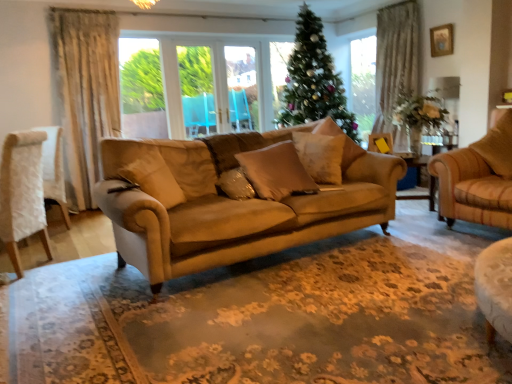
In order to click on white fabric chair at left in this screenshot , I will do `click(22, 193)`.

What is the approximate height of beige fabric pillow at right, which is the first pillow from right to left?

It is 24.87 inches.

Locate an element on the screen. The image size is (512, 384). satin beige pillow at center, arranged as the 3th pillow when viewed from the right is located at coordinates (320, 156).

Identify the location of satin beige pillow at center, marked as the 4th pillow in a right-to-left arrangement. (276, 172).

Does green metallic christmas tree at center turn towards satin beige pillow at center, marked as the 4th pillow in a right-to-left arrangement?

No, green metallic christmas tree at center is not facing towards satin beige pillow at center, marked as the 4th pillow in a right-to-left arrangement.

Between green metallic christmas tree at center and satin beige pillow at center, which is the 3th pillow from left to right, which one has larger width?

Wider between the two is green metallic christmas tree at center.

Which is more to the right, green metallic christmas tree at center or satin beige pillow at center, marked as the 4th pillow in a right-to-left arrangement?

green metallic christmas tree at center.

From a real-world perspective, is green metallic christmas tree at center positioned above or below satin beige pillow at center, marked as the 4th pillow in a right-to-left arrangement?

In terms of real-world spatial position, green metallic christmas tree at center is above satin beige pillow at center, marked as the 4th pillow in a right-to-left arrangement.

Considering the relative sizes of white fabric chair at left and satin gold pillow at center, which appears as the 2th pillow when viewed from the left, in the image provided, is white fabric chair at left shorter than satin gold pillow at center, which appears as the 2th pillow when viewed from the left,?

No.

Which of these two, white fabric chair at left or satin gold pillow at center, positioned as the 5th pillow in right-to-left order, is smaller?

satin gold pillow at center, positioned as the 5th pillow in right-to-left order.

From a real-world perspective, which object rests below the other?

white fabric chair at left is physically lower.

Consider the image. Could satin gold pillow at center, positioned as the 5th pillow in right-to-left order, be considered to be inside white fabric chair at left?

No, satin gold pillow at center, positioned as the 5th pillow in right-to-left order, is located outside of white fabric chair at left.

Which object is thinner, satin beige pillow at center, arranged as the 3th pillow when viewed from the right, or satin beige pillow at center, which is the 3th pillow from left to right?

satin beige pillow at center, arranged as the 3th pillow when viewed from the right.

From the picture: Could you tell me if satin beige pillow at center, the 4th pillow in the left-to-right sequence, is turned towards satin beige pillow at center, marked as the 4th pillow in a right-to-left arrangement?

Yes, satin beige pillow at center, the 4th pillow in the left-to-right sequence, is turned towards satin beige pillow at center, marked as the 4th pillow in a right-to-left arrangement.

From a real-world perspective, does satin beige pillow at center, arranged as the 3th pillow when viewed from the right, stand above satin beige pillow at center, marked as the 4th pillow in a right-to-left arrangement?

Correct, in the physical world, satin beige pillow at center, arranged as the 3th pillow when viewed from the right, is higher than satin beige pillow at center, marked as the 4th pillow in a right-to-left arrangement.

Is satin beige pillow at center, arranged as the 3th pillow when viewed from the right, bigger or smaller than satin beige pillow at center, which is the 3th pillow from left to right?

satin beige pillow at center, arranged as the 3th pillow when viewed from the right, is smaller than satin beige pillow at center, which is the 3th pillow from left to right.

From the picture: Is satin gold pillow at center, which appears as the 2th pillow when viewed from the left, oriented towards satin beige pillow at center, marked as the 4th pillow in a right-to-left arrangement?

Yes, satin gold pillow at center, which appears as the 2th pillow when viewed from the left, is aimed at satin beige pillow at center, marked as the 4th pillow in a right-to-left arrangement.

Is satin beige pillow at center, which is the 3th pillow from left to right, surrounded by satin gold pillow at center, positioned as the 5th pillow in right-to-left order?

No.

From the image's perspective, is satin gold pillow at center, positioned as the 5th pillow in right-to-left order, under satin beige pillow at center, marked as the 4th pillow in a right-to-left arrangement?

Yes.

Between satin gold pillow at center, positioned as the 5th pillow in right-to-left order, and satin beige pillow at center, marked as the 4th pillow in a right-to-left arrangement, which one has more height?

satin beige pillow at center, marked as the 4th pillow in a right-to-left arrangement, is taller.

Can you confirm if satin beige pillow at center, the 4th pillow in the left-to-right sequence, is positioned to the right of white fabric chair at left?

Yes, satin beige pillow at center, the 4th pillow in the left-to-right sequence, is to the right of white fabric chair at left.

Which is behind, satin beige pillow at center, the 4th pillow in the left-to-right sequence, or white fabric chair at left?

satin beige pillow at center, the 4th pillow in the left-to-right sequence, is behind.

From a real-world perspective, is satin beige pillow at center, the 4th pillow in the left-to-right sequence, positioned above or below white fabric chair at left?

satin beige pillow at center, the 4th pillow in the left-to-right sequence, is situated higher than white fabric chair at left in the real world.

Is wooden picture frame at upper right positioned before beige fabric pillow at center, the sixth pillow in the right-to-left sequence?

That is False.

Considering the sizes of objects wooden picture frame at upper right and beige fabric pillow at center, which is the first pillow from left to right, in the image provided, who is taller, wooden picture frame at upper right or beige fabric pillow at center, which is the first pillow from left to right,?

beige fabric pillow at center, which is the first pillow from left to right, is taller.

Does point (443, 40) come in front of point (157, 184)?

That is False.

From a real-world perspective, between wooden picture frame at upper right and beige fabric pillow at center, which is the first pillow from left to right, who is vertically higher?

wooden picture frame at upper right, from a real-world perspective.

Which is behind, point (226, 191) or point (324, 133)?

The point (324, 133) is more distant.

From a real-world perspective, is satin gold pillow at center, which appears as the 2th pillow when viewed from the left, physically below suede-like beige pillow at center, the fifth pillow in the left-to-right sequence?

Correct, in the physical world, satin gold pillow at center, which appears as the 2th pillow when viewed from the left, is lower than suede-like beige pillow at center, the fifth pillow in the left-to-right sequence.

From the image's perspective, which object appears higher, satin gold pillow at center, positioned as the 5th pillow in right-to-left order, or suede-like beige pillow at center, acting as the 2th pillow starting from the right?

From the image's view, suede-like beige pillow at center, acting as the 2th pillow starting from the right, is above.

Identify the location of pillow that is the 3rd one when counting leftward from the green metallic christmas tree at center. (276, 172).

Image resolution: width=512 pixels, height=384 pixels. In order to click on chair below the satin gold pillow at center, positioned as the 5th pillow in right-to-left order (from the image's perspective) in this screenshot , I will do `click(22, 193)`.

Based on their spatial positions, is beige fabric pillow at center, the sixth pillow in the right-to-left sequence, or satin gold pillow at center, positioned as the 5th pillow in right-to-left order, closer to suede-like beige pillow at center, the fifth pillow in the left-to-right sequence?

satin gold pillow at center, positioned as the 5th pillow in right-to-left order, lies closer to suede-like beige pillow at center, the fifth pillow in the left-to-right sequence, than the other object.

Estimate the real-world distances between objects in this image. Which object is further from satin gold pillow at center, which appears as the 2th pillow when viewed from the left, satin beige pillow at center, which is the 3th pillow from left to right, or beige fabric pillow at center, which is the first pillow from left to right?

Based on the image, beige fabric pillow at center, which is the first pillow from left to right, appears to be further to satin gold pillow at center, which appears as the 2th pillow when viewed from the left.

Looking at this image, looking at the image, which one is located further to beige fabric pillow at center, the sixth pillow in the right-to-left sequence, satin beige pillow at center, the 4th pillow in the left-to-right sequence, or green metallic christmas tree at center?

green metallic christmas tree at center lies further to beige fabric pillow at center, the sixth pillow in the right-to-left sequence, than the other object.

Estimate the real-world distances between objects in this image. Which object is closer to satin gold pillow at center, positioned as the 5th pillow in right-to-left order, satin beige pillow at center, marked as the 4th pillow in a right-to-left arrangement, or wooden picture frame at upper right?

satin beige pillow at center, marked as the 4th pillow in a right-to-left arrangement, is closer to satin gold pillow at center, positioned as the 5th pillow in right-to-left order.

Considering their positions, is beige fabric pillow at center, the sixth pillow in the right-to-left sequence, positioned further to satin gold pillow at center, which appears as the 2th pillow when viewed from the left, than satin beige pillow at center, arranged as the 3th pillow when viewed from the right?

Based on the image, satin beige pillow at center, arranged as the 3th pillow when viewed from the right, appears to be further to satin gold pillow at center, which appears as the 2th pillow when viewed from the left.

Looking at the image, which one is located further to satin beige pillow at center, which is the 3th pillow from left to right, satin beige pillow at center, the 4th pillow in the left-to-right sequence, or wooden picture frame at upper right?

The object further to satin beige pillow at center, which is the 3th pillow from left to right, is wooden picture frame at upper right.

From the image, which object appears to be nearer to white fabric chair at left, green metallic christmas tree at center or wooden picture frame at upper right?

The object closer to white fabric chair at left is green metallic christmas tree at center.

Considering their positions, is satin beige pillow at center, marked as the 4th pillow in a right-to-left arrangement, positioned closer to green metallic christmas tree at center than beige fabric pillow at center, the sixth pillow in the right-to-left sequence?

satin beige pillow at center, marked as the 4th pillow in a right-to-left arrangement, is positioned closer to the anchor green metallic christmas tree at center.

The height and width of the screenshot is (384, 512). Identify the location of pillow located between satin gold pillow at center, which appears as the 2th pillow when viewed from the left, and satin beige pillow at center, the 4th pillow in the left-to-right sequence, in the left-right direction. (276, 172).

Where is `christmas tree between satin gold pillow at center, positioned as the 5th pillow in right-to-left order, and wooden picture frame at upper right from left to right`? christmas tree between satin gold pillow at center, positioned as the 5th pillow in right-to-left order, and wooden picture frame at upper right from left to right is located at coordinates (314, 80).

The width and height of the screenshot is (512, 384). I want to click on christmas tree located between beige fabric pillow at center, which is the first pillow from left to right, and beige fabric pillow at right, the 6th pillow when ordered from left to right, in the left-right direction, so click(x=314, y=80).

The image size is (512, 384). I want to click on pillow positioned between satin beige pillow at center, the 4th pillow in the left-to-right sequence, and wooden picture frame at upper right from near to far, so click(350, 153).